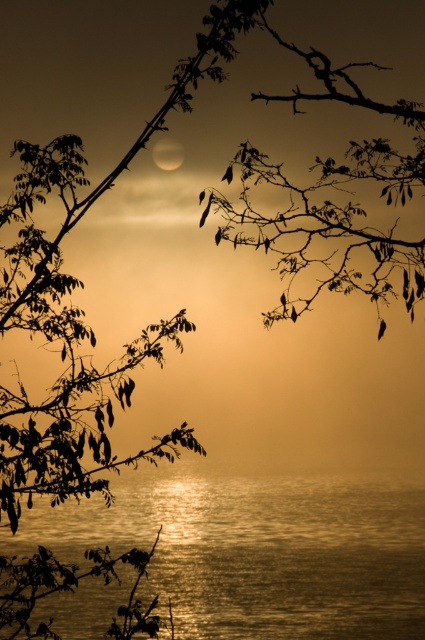
You are an astronomer observing the sunset scene. You notice the glistening water at center and the smooth white moon at upper center. Which object has a greater width in the image?

The glistening water at center has a greater width than the smooth white moon at upper center according to the description.

You are standing at the point closer to the water in the sunset scene. Which point are you at, point (146, 547) or point (170, 161)?

Point (170, 161) is closer to the water, so you are at point (170, 161).

You are an astronomer observing the sunset and notice the glistening water at center and the smooth white moon at upper center. Which celestial object appears larger in the sky from your viewpoint?

The glistening water at center is much taller than the smooth white moon at upper center, so the glistening water at center appears larger in the sky from your viewpoint.